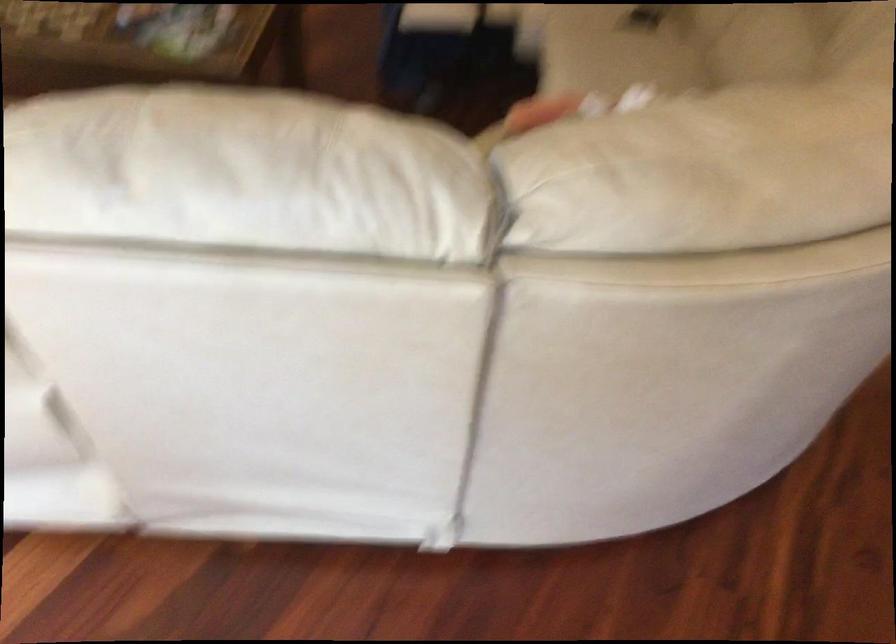
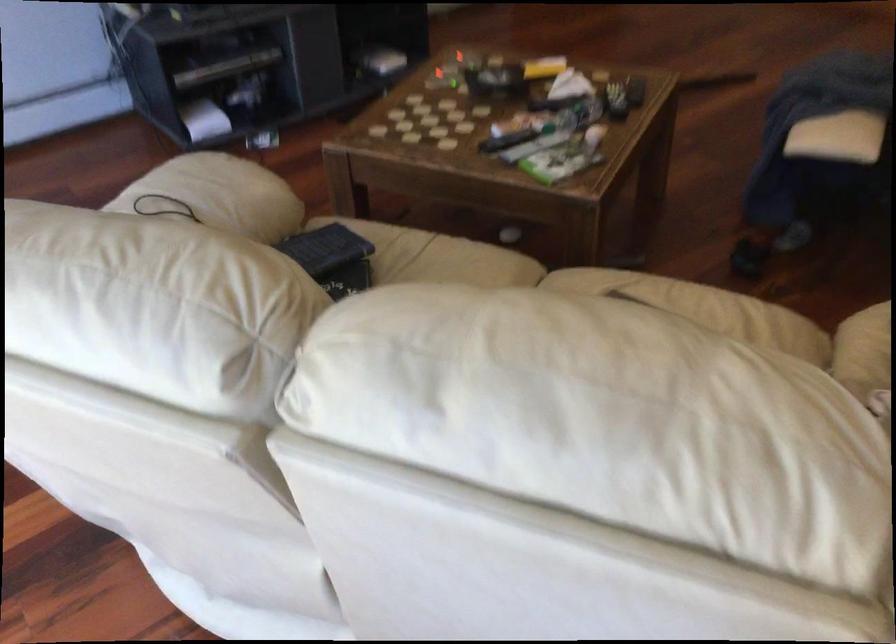
Question: How did the camera likely rotate?

Choices:
 (A) Left
 (B) Right
 (C) Up
 (D) Down

Answer: (A)